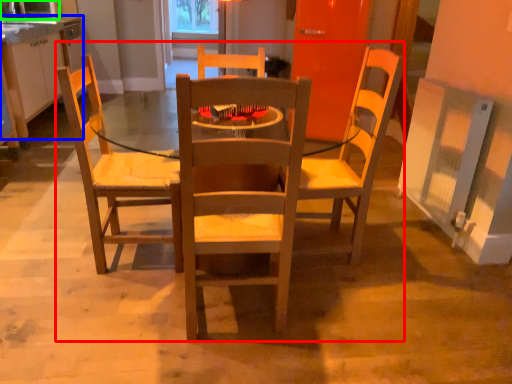
Question: Based on their relative distances, which object is farther from trio (highlighted by a red box)? Choose from cabinetry (highlighted by a blue box) and microwave oven (highlighted by a green box).

Choices:
 (A) cabinetry
 (B) microwave oven

Answer: (B)